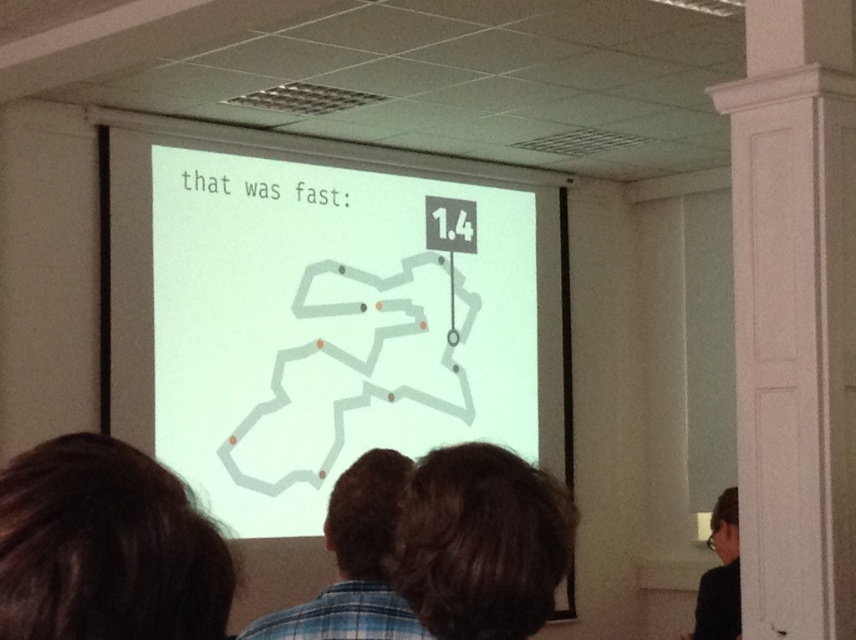
Question: Does dark brown hair at lower left appear over black glossy hair at upper right?

Choices:
 (A) yes
 (B) no

Answer: (A)

Question: Which point is farther to the camera?

Choices:
 (A) tap(354, 604)
 (B) tap(15, 589)
 (C) tap(752, 177)
 (D) tap(559, 321)

Answer: (D)

Question: Which point appears closest to the camera in this image?

Choices:
 (A) [218, 625]
 (B) [373, 636]

Answer: (A)

Question: Is white smooth pillar at right wider than dark brown hair at lower left?

Choices:
 (A) no
 (B) yes

Answer: (B)

Question: Among these objects, which one is farthest from the camera?

Choices:
 (A) black glossy hair at upper right
 (B) white matte projection screen at center

Answer: (B)

Question: Does white matte projection screen at center appear on the right side of black glossy hair at upper right?

Choices:
 (A) yes
 (B) no

Answer: (B)